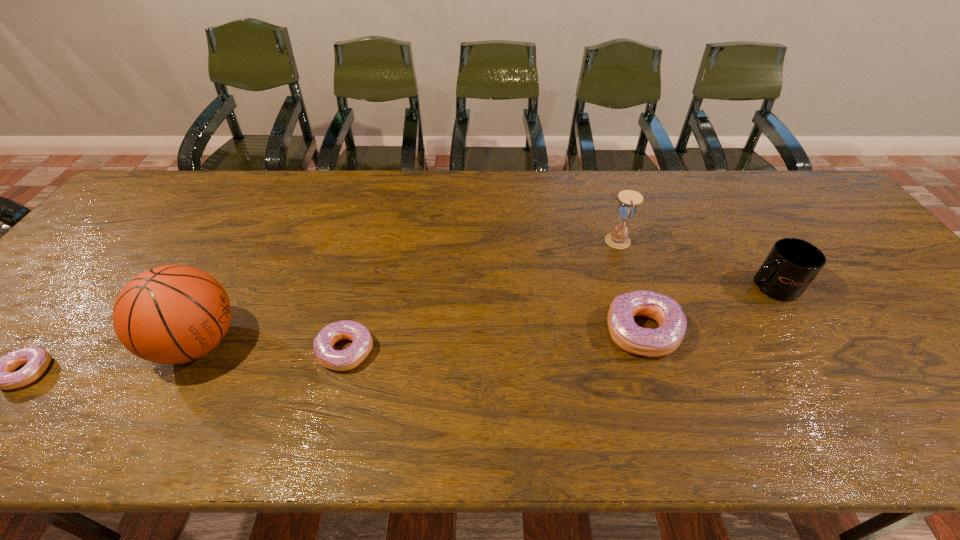
Please point a spot to add another doughnut on the right. Please provide its 2D coordinates. Your answer should be formatted as a tuple, i.e. [(x, y)], where the tuple contains the x and y coordinates of a point satisfying the conditions above.

[(917, 313)]